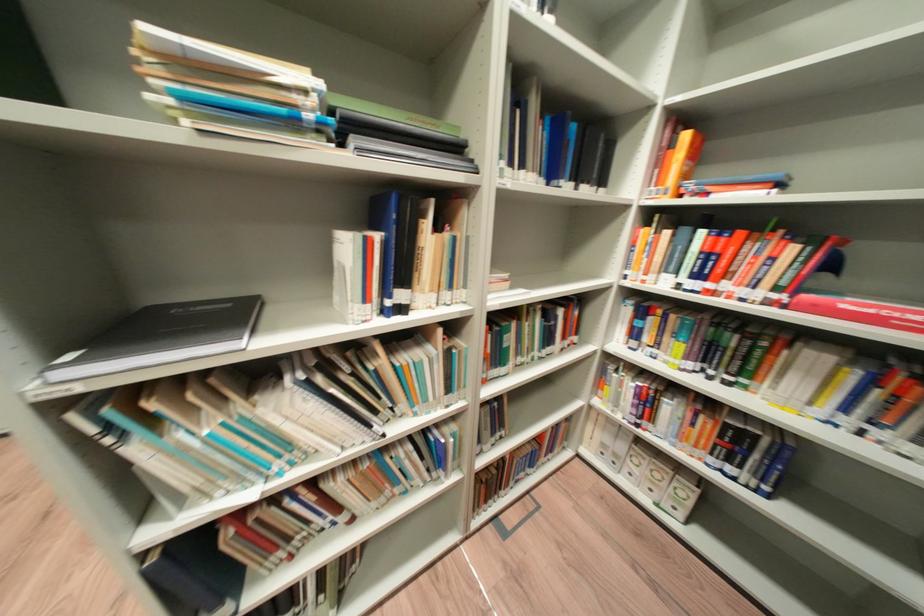
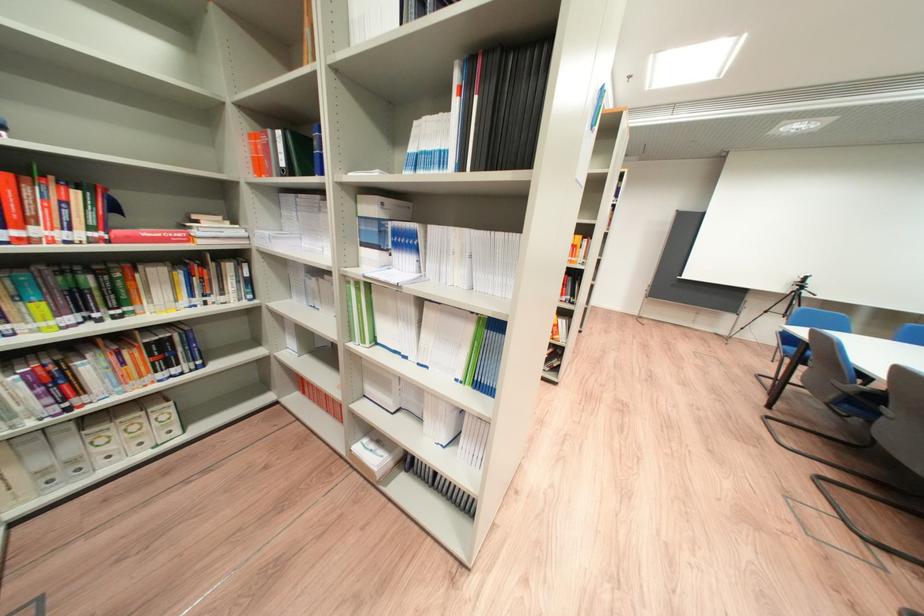
How did the camera likely rotate?

The rotation direction of the camera is right-down.